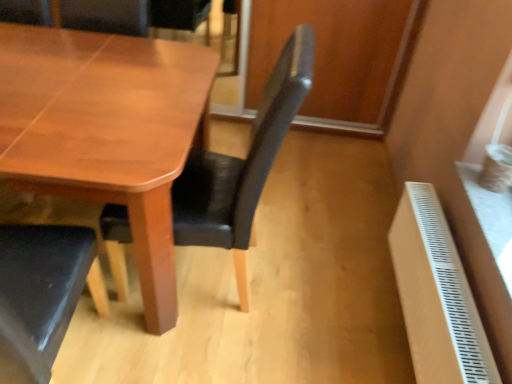
Locate an element on the screen. The image size is (512, 384). vacant area that lies between satin black chair at center and white plastic radiator at lower right is located at coordinates (308, 315).